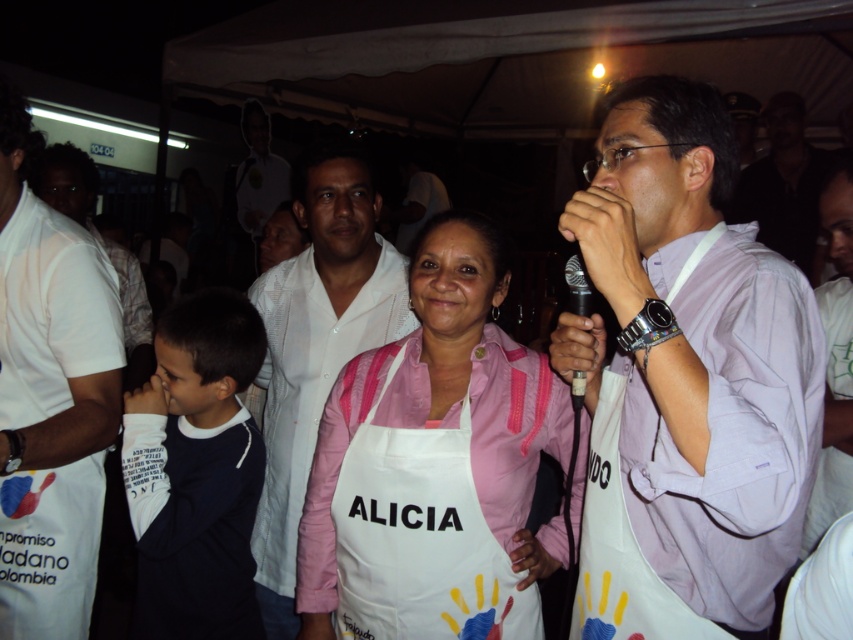
Question: Based on their relative distances, which object is nearer to the white fabric apron at center?

Choices:
 (A) white shirt at center
 (B) white matte shirt at center

Answer: (B)

Question: Considering the real-world distances, which object is farthest from the white fabric apron at center?

Choices:
 (A) pink fabric apron at center
 (B) white shirt at center
 (C) white matte shirt at center
 (D) white fabric shirt at left

Answer: (B)

Question: Does pink fabric apron at center appear on the right side of white shirt at center?

Choices:
 (A) yes
 (B) no

Answer: (B)

Question: Which of these objects is positioned farthest from the white fabric apron at center?

Choices:
 (A) white matte shirt at center
 (B) pink fabric apron at center

Answer: (A)

Question: Can you confirm if white fabric apron at center is bigger than white shirt at center?

Choices:
 (A) yes
 (B) no

Answer: (B)

Question: Can you confirm if white fabric apron at center is wider than pink fabric apron at center?

Choices:
 (A) yes
 (B) no

Answer: (B)